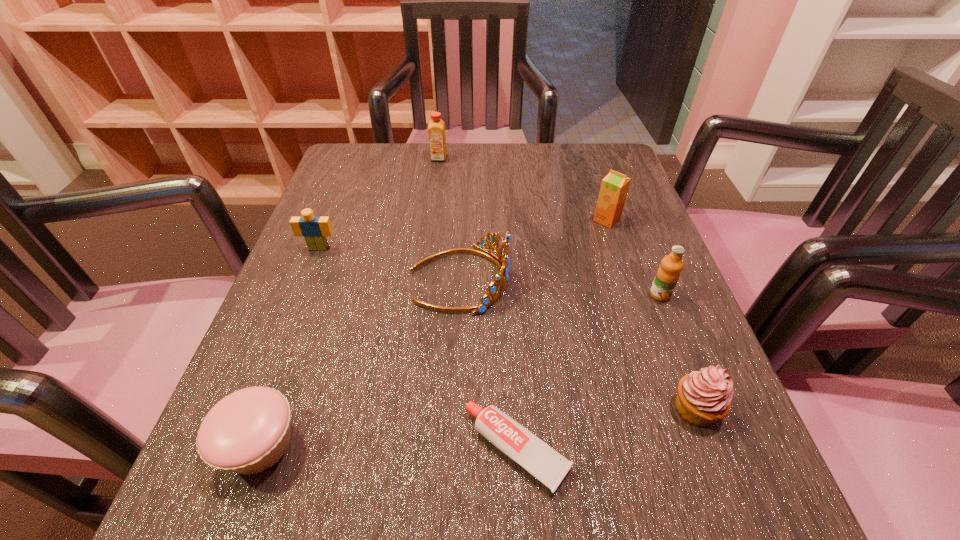
Locate an element on the screen. free space between the tiara and the farthest orange juice is located at coordinates (449, 219).

Find the location of a particular element. This screenshot has height=540, width=960. empty space between the tiara and the leftmost orange juice is located at coordinates (449, 219).

In order to click on vacant point located between the rightmost orange juice and the second orange juice from left to right in this screenshot , I will do `click(634, 257)`.

Where is `vacant point located between the nearest orange juice and the shortest object`? The image size is (960, 540). vacant point located between the nearest orange juice and the shortest object is located at coordinates (588, 372).

I want to click on object that is the third closest to the toothpaste, so click(x=248, y=431).

Locate which object is the fifth closest to the Lego. Please provide its 2D coordinates. Your answer should be formatted as a tuple, i.e. [(x, y)], where the tuple contains the x and y coordinates of a point satisfying the conditions above.

[(614, 187)]

Identify which orange juice is located as the nearest to the second nearest orange juice. Please provide its 2D coordinates. Your answer should be formatted as a tuple, i.e. [(x, y)], where the tuple contains the x and y coordinates of a point satisfying the conditions above.

[(667, 276)]

The width and height of the screenshot is (960, 540). What are the coordinates of `orange juice that stands as the second closest to the right cupcake` in the screenshot? It's located at (614, 187).

Find the location of a particular element. This screenshot has width=960, height=540. vacant space that satisfies the following two spatial constraints: 1. on the face of the Lego; 2. on the right side of the right cupcake is located at coordinates [255, 409].

Image resolution: width=960 pixels, height=540 pixels. I want to click on blank space that satisfies the following two spatial constraints: 1. on the back side of the second farthest orange juice; 2. on the right side of the shortest object, so click(503, 220).